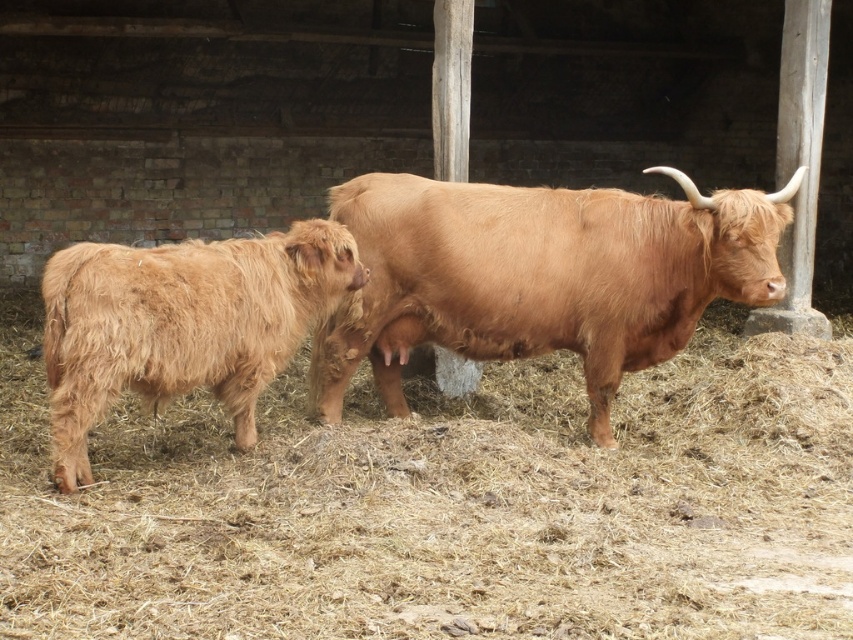
Is brown woolly bull at center bigger than fuzzy brown yak at left?

Yes.

Is brown woolly bull at center closer to camera compared to fuzzy brown yak at left?

No, it is behind fuzzy brown yak at left.

Is point (770, 262) positioned after point (344, 284)?

No, (770, 262) is in front of (344, 284).

Where is `brown woolly bull at center`? The height and width of the screenshot is (640, 853). brown woolly bull at center is located at coordinates (540, 276).